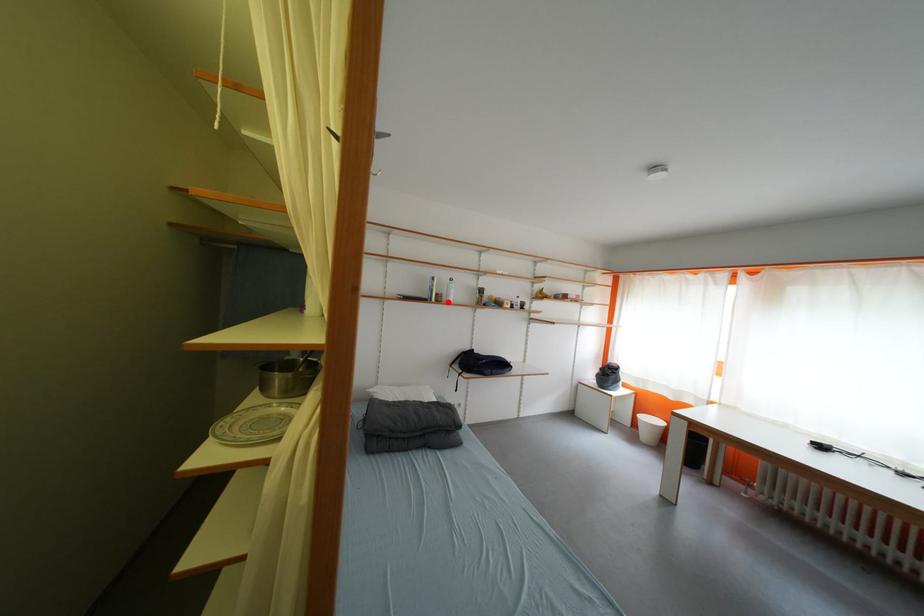
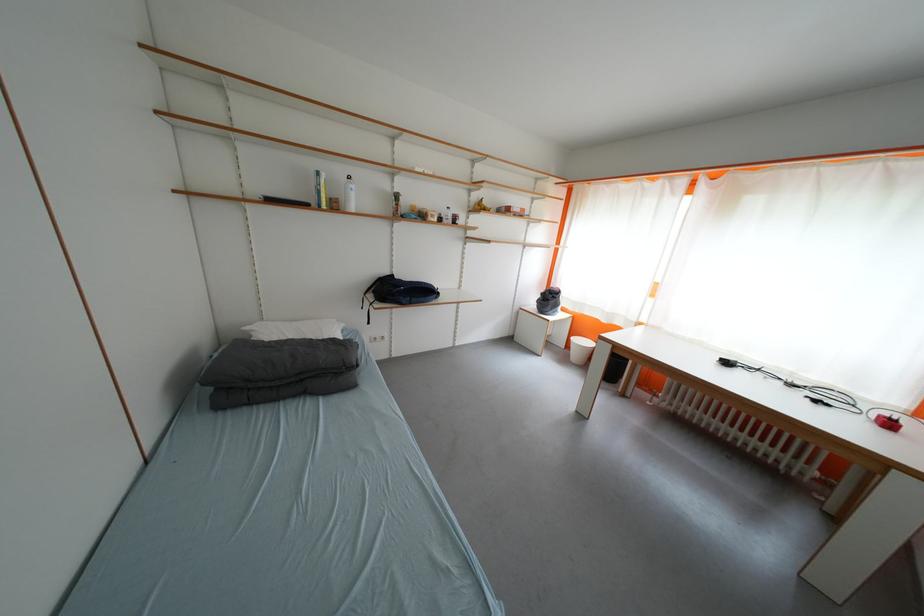
Locate, in the second image, the point that corresponds to the highlighted location in the first image.

(344, 209)